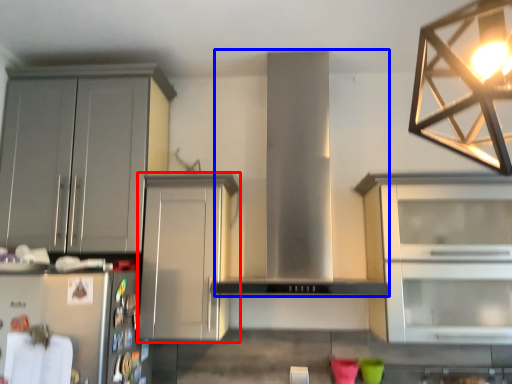
Question: Which object is closer to the camera taking this photo, cabinetry (highlighted by a red box) or hood (highlighted by a blue box)?

Choices:
 (A) cabinetry
 (B) hood

Answer: (B)